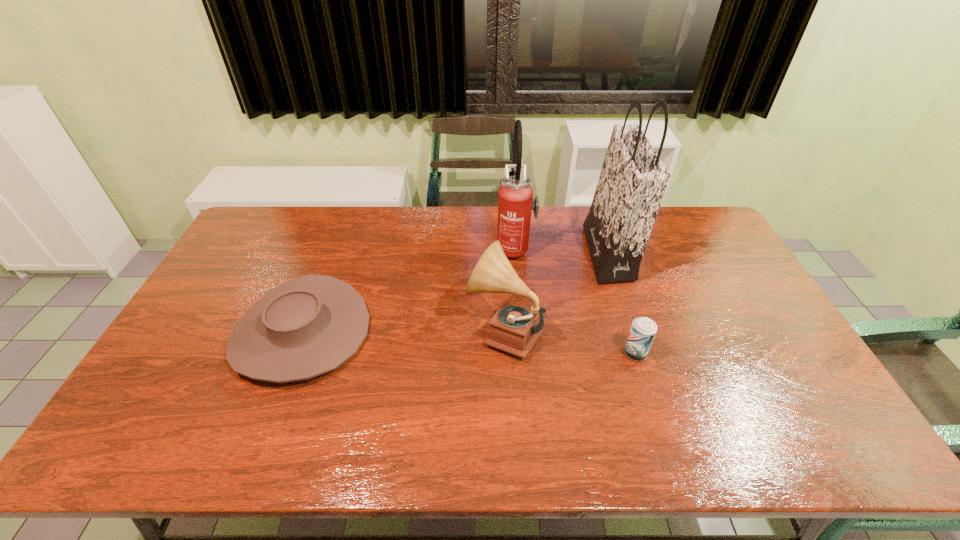
In order to click on vacant area that lies between the shopping bag and the fire extinguisher in this screenshot , I will do `click(561, 251)`.

Find the location of `free space between the second tallest object and the second shortest object`. free space between the second tallest object and the second shortest object is located at coordinates (575, 301).

The height and width of the screenshot is (540, 960). Find the location of `free space between the second tallest object and the shopping bag`. free space between the second tallest object and the shopping bag is located at coordinates (561, 251).

The image size is (960, 540). I want to click on vacant area between the fire extinguisher and the beer can, so click(575, 301).

What are the coordinates of `unoccupied area between the leftmost object and the beer can` in the screenshot? It's located at (468, 343).

Where is `object identified as the second closest to the second shortest object`? object identified as the second closest to the second shortest object is located at coordinates (633, 179).

At what (x,y) coordinates should I click in order to perform the action: click on the third closest object relative to the cowboy hat. Please return your answer as a coordinate pair (x, y). Image resolution: width=960 pixels, height=540 pixels. Looking at the image, I should click on (633, 179).

In order to click on free point that satisfies the following two spatial constraints: 1. on the horn of the phonograph record; 2. on the right side of the fourth tallest object in this screenshot , I will do `click(505, 353)`.

This screenshot has width=960, height=540. I want to click on vacant space that satisfies the following two spatial constraints: 1. on the front side of the shortest object; 2. on the right side of the beer can, so click(294, 353).

You are a GUI agent. You are given a task and a screenshot of the screen. Output one action in this format:
    pyautogui.click(x=<x>, y=<y>)
    Task: Click on the vacant position in the image that satisfies the following two spatial constraints: 1. on the back side of the beer can; 2. at the nozzle of the second tallest object
    Image resolution: width=960 pixels, height=540 pixels.
    Given the screenshot: What is the action you would take?
    pyautogui.click(x=602, y=248)